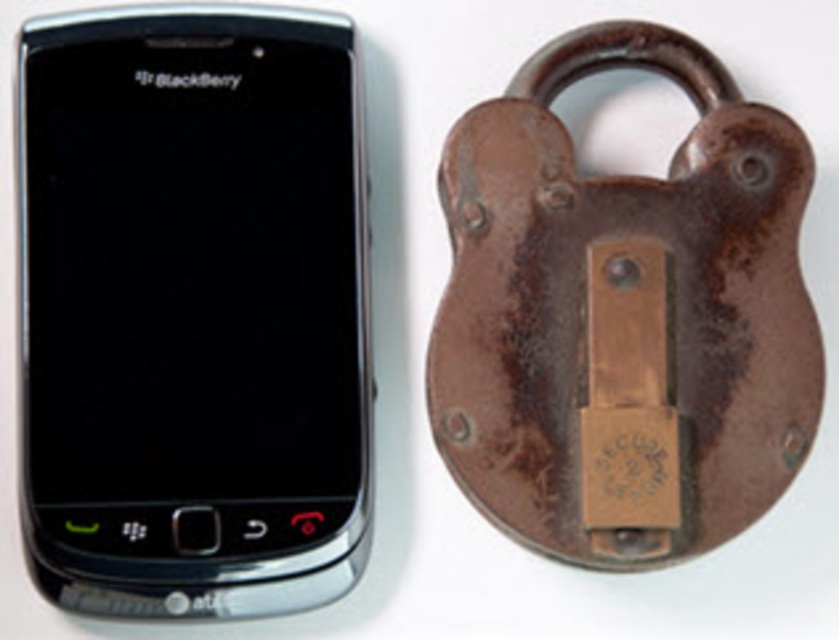
Does black glossy smartphone at left come behind rusty metal padlock at right?

No, black glossy smartphone at left is in front of rusty metal padlock at right.

Describe the element at coordinates (191, 310) in the screenshot. I see `black glossy smartphone at left` at that location.

The image size is (839, 640). Identify the location of black glossy smartphone at left. (191, 310).